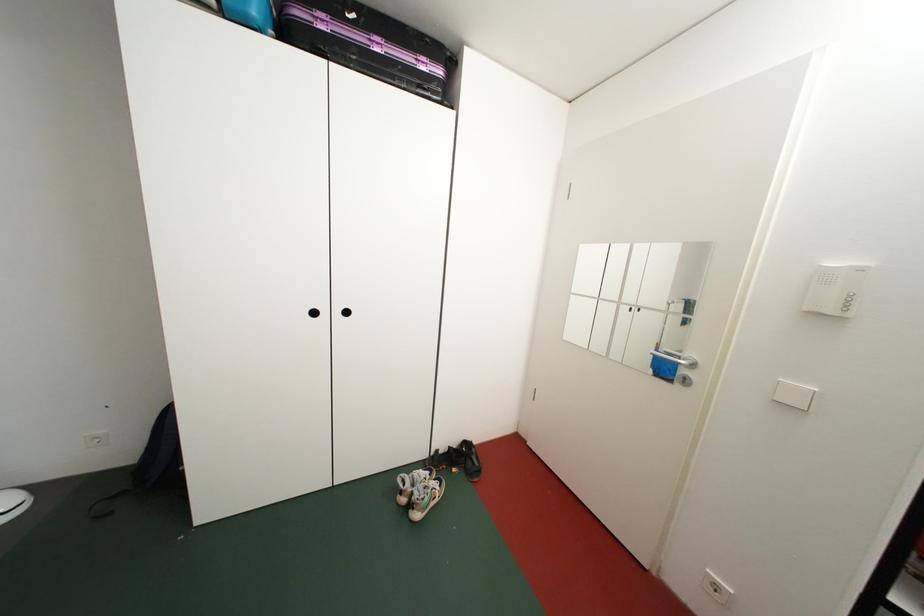
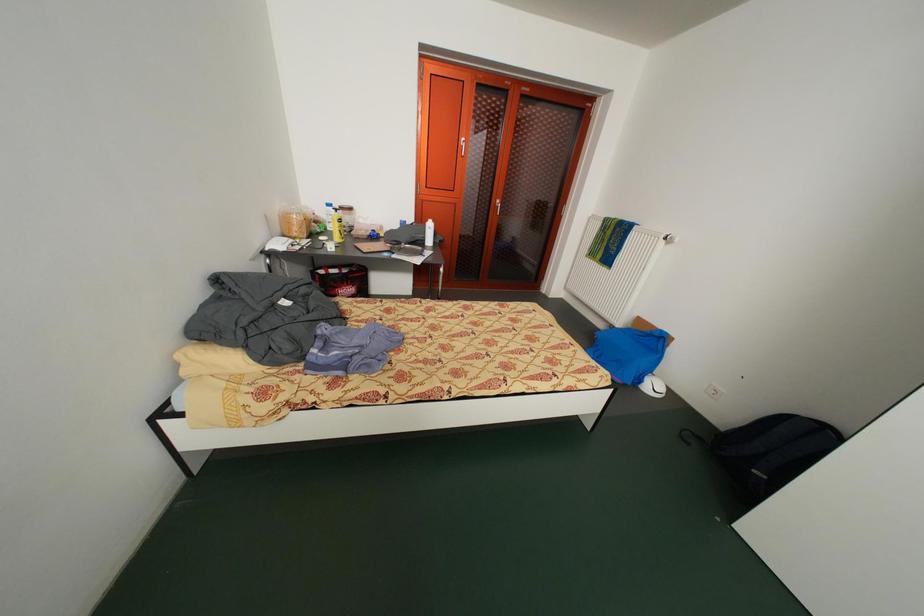
The images are taken continuously from a first-person perspective. In which direction is your viewpoint rotating?

The camera rotated toward left-down.